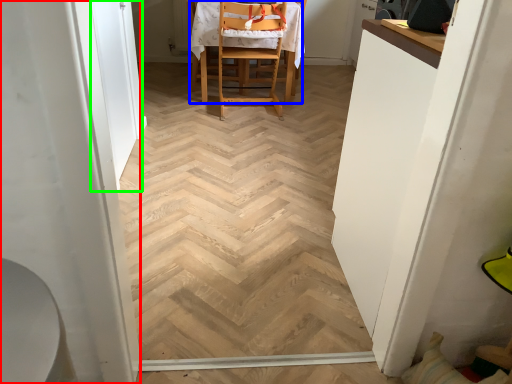
Question: Estimate the real-world distances between objects in this image. Which object is farther from screen door (highlighted by a red box), chair (highlighted by a blue box) or screen door (highlighted by a green box)?

Choices:
 (A) chair
 (B) screen door

Answer: (A)